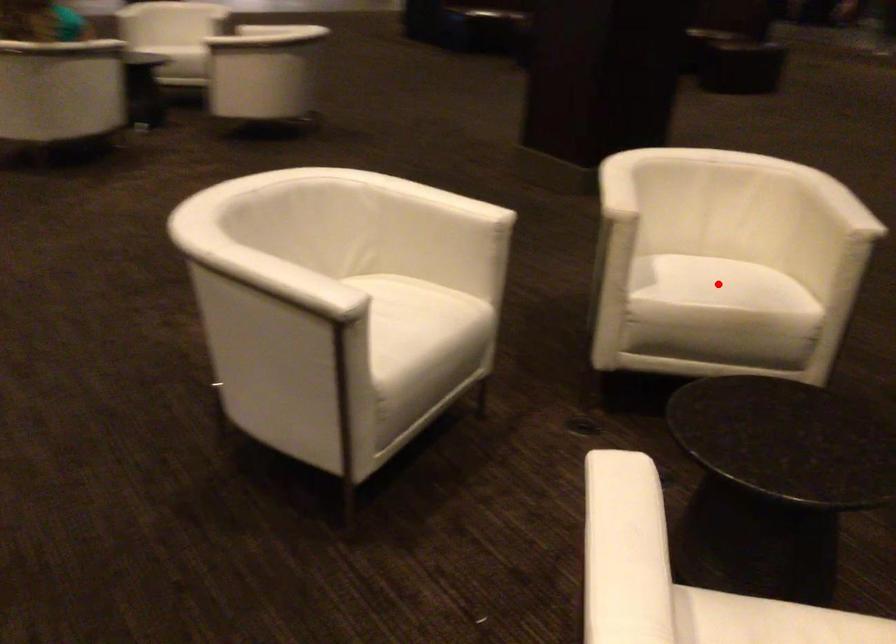
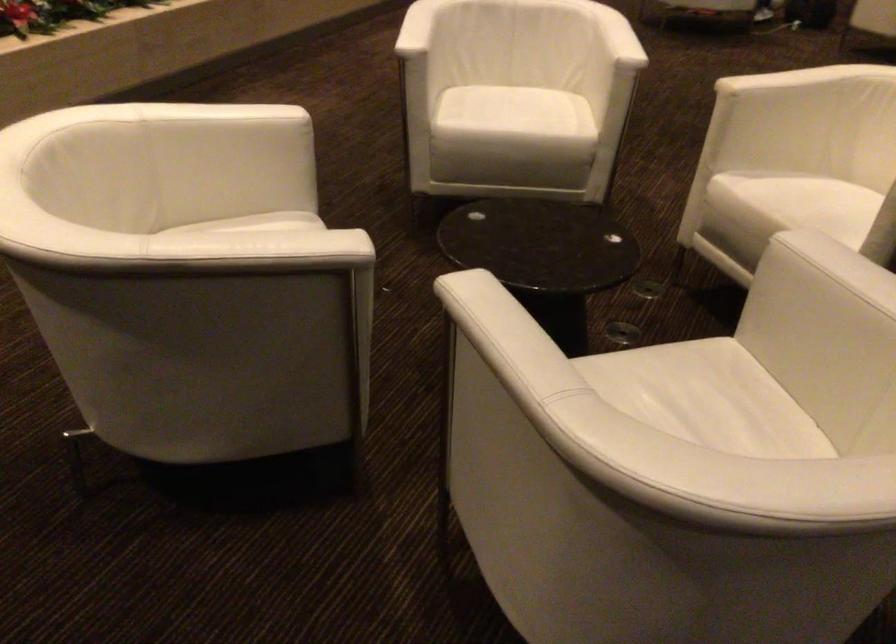
Where in the second image is the point corresponding to the highlighted location from the first image?

(794, 198)